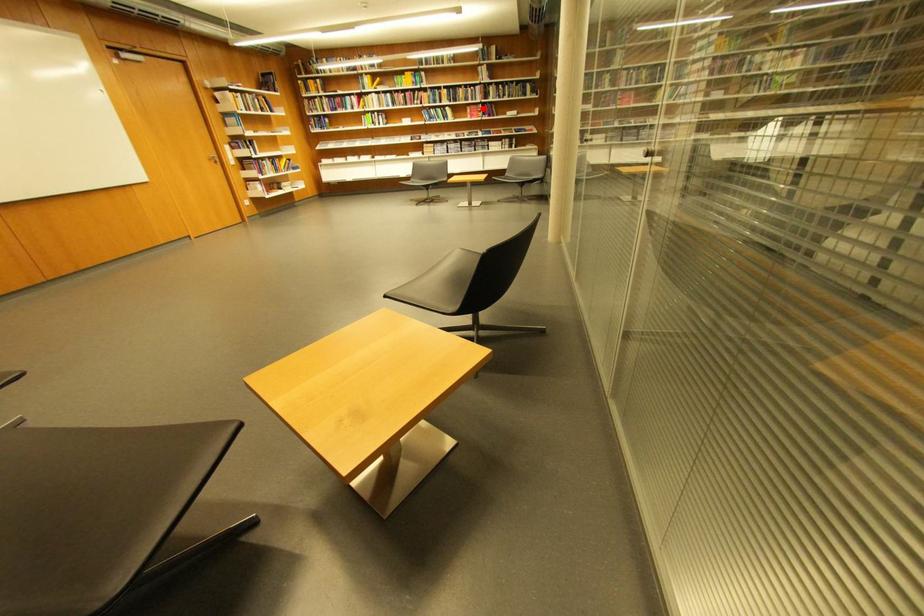
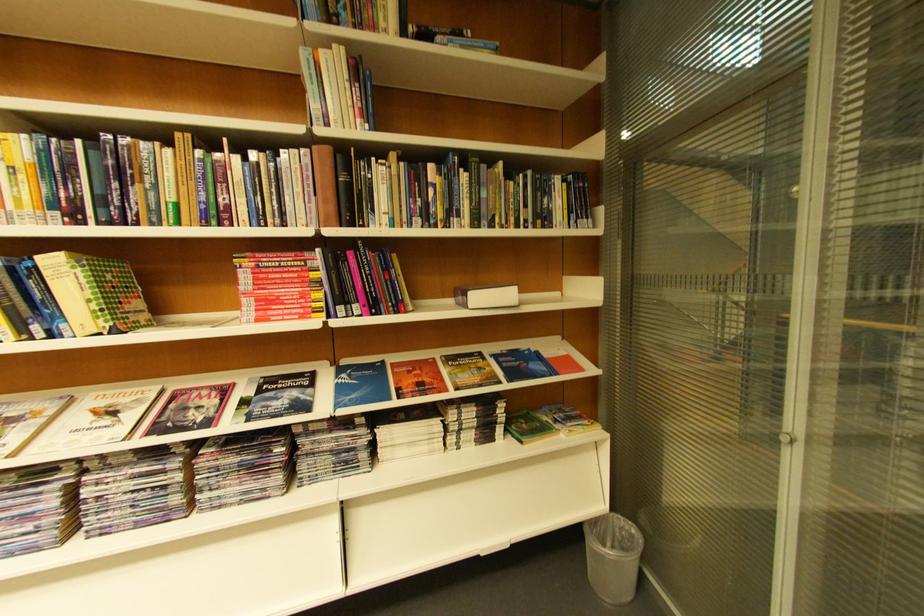
Question: I am providing you with two images of the same scene from different viewpoints. Given a red point in image1, look at the same physical point in image2. Is it:

Choices:
 (A) Closer to the viewpoint
 (B) Farther from the viewpoint

Answer: (B)